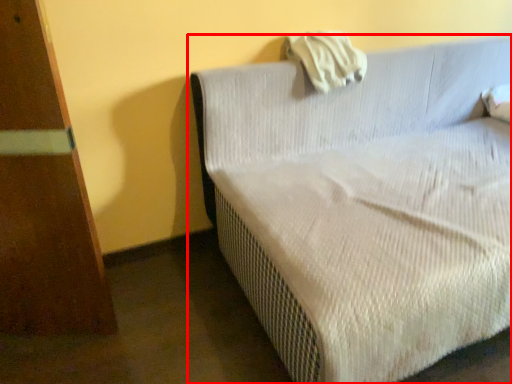
Question: Observing the image, what is the correct spatial positioning of studio couch (annotated by the red box) in reference to pillow?

Choices:
 (A) left
 (B) right

Answer: (B)